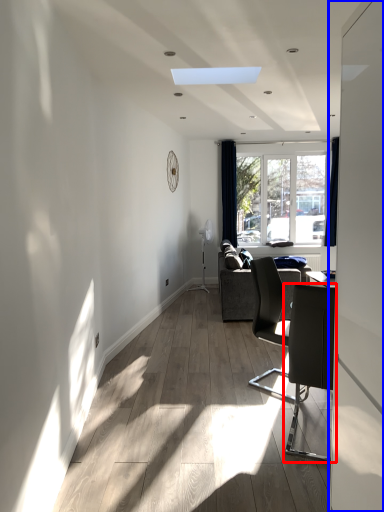
Question: Which object appears farthest to the camera in this image, chair (highlighted by a red box) or screen door (highlighted by a blue box)?

Choices:
 (A) chair
 (B) screen door

Answer: (A)